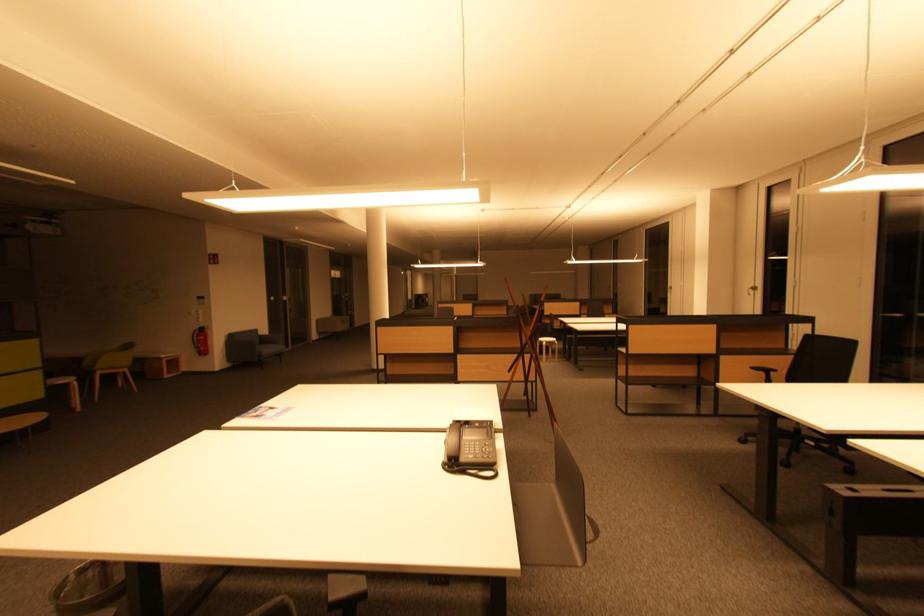
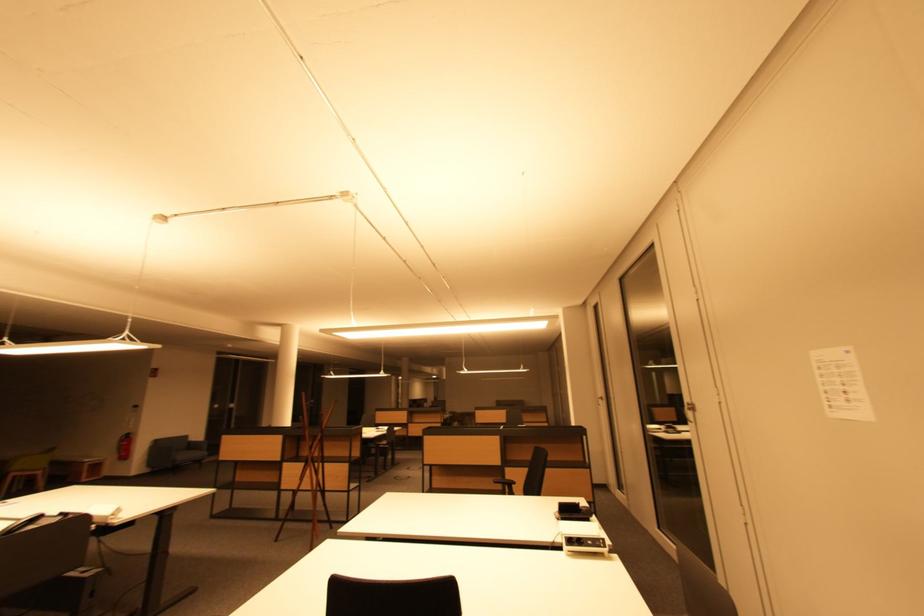
In the second image, find the point that corresponds to (x=272, y=352) in the first image.

(188, 458)